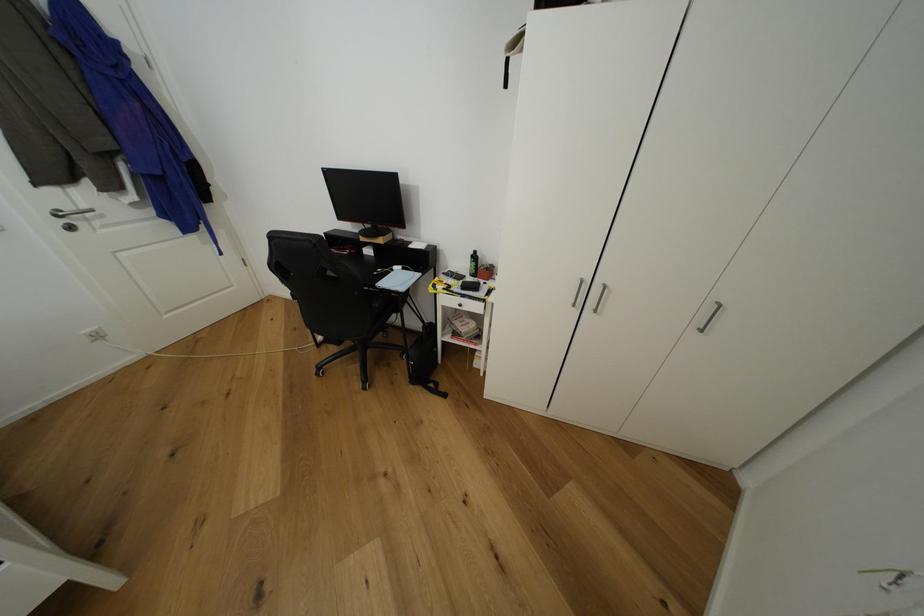
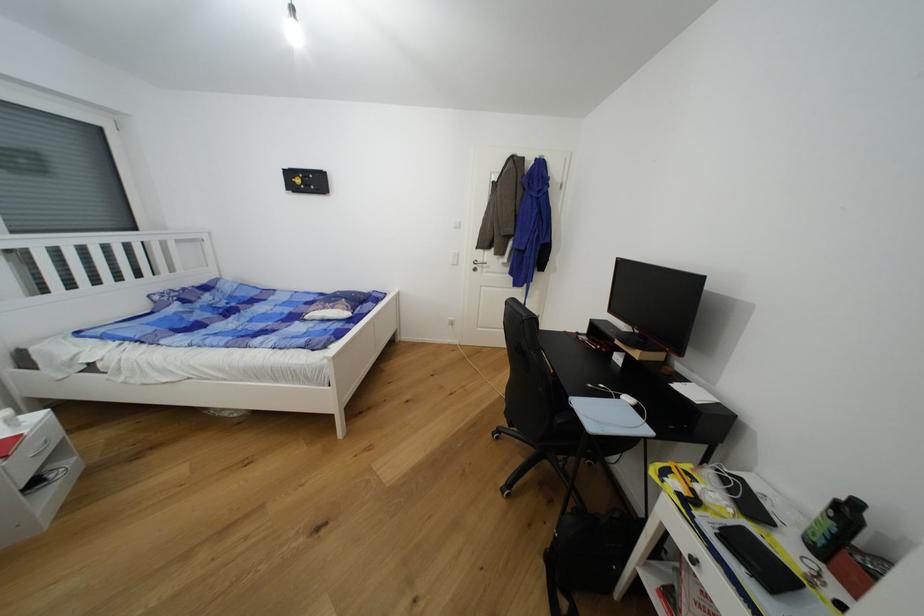
Question: The first image is from the beginning of the video and the second image is from the end. How did the camera likely rotate when shooting the video?

Choices:
 (A) Left
 (B) Right
 (C) Up
 (D) Down

Answer: (A)